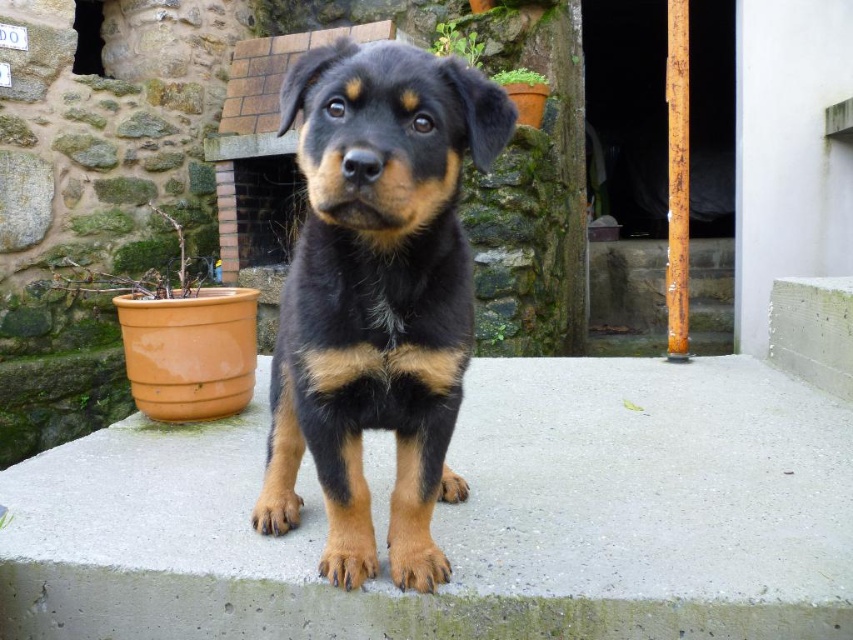
You are standing at the edge of the smooth concrete at center and want to walk to the smooth concrete stairs at center. Which surface will you step on first?

You will step on the smooth concrete at center first because it occupies less space than the smooth concrete stairs at center, so it is closer to your starting position.

You are standing on the smooth concrete stairs at center and want to move to the smooth concrete at center. Which direction should you go?

You should go to the left because the smooth concrete at center is to the left of the smooth concrete stairs at center.